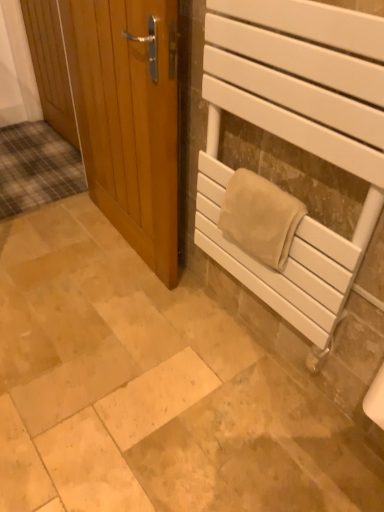
This screenshot has height=512, width=384. I want to click on wooden door at left, the second door when ordered from right to left, so click(50, 66).

You are a GUI agent. You are given a task and a screenshot of the screen. Output one action in this format:
    pyautogui.click(x=<x>, y=<y>)
    Task: Click on the light brown wooden door at left, the 1th door in the front-to-back sequence
    Image resolution: width=384 pixels, height=512 pixels.
    Given the screenshot: What is the action you would take?
    pyautogui.click(x=129, y=118)

In order to face beige soft towel at right, should I rotate leftwards or rightwards?

Turn right approximately 9.276 degrees to face it.

At what (x,y) coordinates should I click in order to perform the action: click on white matte towel rack at right. Please return your answer as a coordinate pair (x, y). Looking at the image, I should click on (295, 138).

Image resolution: width=384 pixels, height=512 pixels. In order to click on wooden door at left, marked as the second door in a front-to-back arrangement in this screenshot , I will do `click(50, 66)`.

From a real-world perspective, between wooden door at left, the second door when ordered from right to left, and light brown wooden door at left, arranged as the 2th door when viewed from the back, who is vertically higher?

light brown wooden door at left, arranged as the 2th door when viewed from the back, is physically above.

Considering their positions, is wooden door at left, marked as the second door in a front-to-back arrangement, located in front of or behind light brown wooden door at left, the 1th door in the front-to-back sequence?

wooden door at left, marked as the second door in a front-to-back arrangement, is positioned farther from the viewer than light brown wooden door at left, the 1th door in the front-to-back sequence.

Does point (38, 31) appear closer or farther from the camera than point (129, 106)?

Point (38, 31) appears to be farther away from the viewer than point (129, 106).

Considering the relative sizes of wooden door at left, marked as the second door in a front-to-back arrangement, and light brown wooden door at left, the 1th door in the front-to-back sequence, in the image provided, is wooden door at left, marked as the second door in a front-to-back arrangement, shorter than light brown wooden door at left, the 1th door in the front-to-back sequence,?

Yes.

Between wooden door at left, the second door when ordered from right to left, and beige soft towel at right, which one has smaller width?

Thinner between the two is wooden door at left, the second door when ordered from right to left.

In order to click on the 2nd door behind when counting from the beige soft towel at right in this screenshot , I will do `click(50, 66)`.

Can you confirm if wooden door at left, marked as the second door in a front-to-back arrangement, is positioned to the left of beige soft towel at right?

Yes, wooden door at left, marked as the second door in a front-to-back arrangement, is to the left of beige soft towel at right.

From a real-world perspective, between wooden door at left, marked as the second door in a front-to-back arrangement, and beige soft towel at right, who is vertically higher?

beige soft towel at right.

Is light brown wooden door at left, the second door from the left, not near beige soft towel at right?

No, there isn't a large distance between light brown wooden door at left, the second door from the left, and beige soft towel at right.

Considering the relative sizes of light brown wooden door at left, the 1th door in the front-to-back sequence, and beige soft towel at right in the image provided, is light brown wooden door at left, the 1th door in the front-to-back sequence, bigger than beige soft towel at right?

Correct, light brown wooden door at left, the 1th door in the front-to-back sequence, is larger in size than beige soft towel at right.

Considering the points (139, 58) and (304, 214), which point is behind, point (139, 58) or point (304, 214)?

The point (139, 58) is farther from the camera.

From the image's perspective, relative to beige soft towel at right, is light brown wooden door at left, the 1th door in the front-to-back sequence, above or below?

light brown wooden door at left, the 1th door in the front-to-back sequence, is above beige soft towel at right.

Where is `elevator above the wooden door at left, which is counted as the first door, starting from the back (from a real-world perspective)`? elevator above the wooden door at left, which is counted as the first door, starting from the back (from a real-world perspective) is located at coordinates (295, 138).

Considering the points (30, 38) and (203, 243), which point is in front, point (30, 38) or point (203, 243)?

The point (203, 243) is more forward.

Does wooden door at left, which is counted as the 1th door, starting from the left, have a lesser height compared to white matte towel rack at right?

Indeed, wooden door at left, which is counted as the 1th door, starting from the left, has a lesser height compared to white matte towel rack at right.

Is the position of wooden door at left, marked as the second door in a front-to-back arrangement, more distant than that of white matte towel rack at right?

That is True.

How far apart are beige soft towel at right and wooden door at left, marked as the second door in a front-to-back arrangement?

beige soft towel at right is 1.55 meters away from wooden door at left, marked as the second door in a front-to-back arrangement.

Locate an element on the screen. The image size is (384, 512). the 2nd door positioned above the beige soft towel at right (from the image's perspective) is located at coordinates [x=50, y=66].

Is beige soft towel at right outside of wooden door at left, which is counted as the 1th door, starting from the left?

Yes, beige soft towel at right is not within wooden door at left, which is counted as the 1th door, starting from the left.

Considering the relative sizes of beige soft towel at right and wooden door at left, the second door when ordered from right to left, in the image provided, is beige soft towel at right taller than wooden door at left, the second door when ordered from right to left,?

Incorrect, the height of beige soft towel at right is not larger of that of wooden door at left, the second door when ordered from right to left.

In the image, is light brown wooden door at left, the 1th door in the front-to-back sequence, positioned in front of or behind white matte towel rack at right?

Clearly, light brown wooden door at left, the 1th door in the front-to-back sequence, is behind white matte towel rack at right.

How much distance is there between light brown wooden door at left, arranged as the 2th door when viewed from the back, and white matte towel rack at right?

A distance of 17.17 inches exists between light brown wooden door at left, arranged as the 2th door when viewed from the back, and white matte towel rack at right.

Considering the positions of point (99, 85) and point (317, 290), is point (99, 85) closer or farther from the camera than point (317, 290)?

Point (99, 85) appears to be farther away from the viewer than point (317, 290).

In the scene shown: From their relative heights in the image, would you say light brown wooden door at left, arranged as the 2th door when viewed from the back, is taller or shorter than white matte towel rack at right?

In the image, light brown wooden door at left, arranged as the 2th door when viewed from the back, appears to be taller than white matte towel rack at right.

Are beige soft towel at right and white matte towel rack at right far apart?

That's not correct — beige soft towel at right is a little close to white matte towel rack at right.

Which of these two, beige soft towel at right or white matte towel rack at right, stands taller?

white matte towel rack at right.

Between point (244, 201) and point (339, 263), which one is positioned behind?

The point (244, 201) is more distant.

Considering the positions of objects beige soft towel at right and white matte towel rack at right in the image provided, who is more to the left, beige soft towel at right or white matte towel rack at right?

beige soft towel at right.

What are the coordinates of `door below the light brown wooden door at left, the 1th door in the front-to-back sequence (from a real-world perspective)` in the screenshot? It's located at (50, 66).

In order to click on the 2nd door counting from the left of the beige soft towel at right in this screenshot , I will do `click(50, 66)`.

Consider the image. When comparing their distances from light brown wooden door at left, the 1th door in the front-to-back sequence, does wooden door at left, marked as the second door in a front-to-back arrangement, or beige soft towel at right seem closer?

The object closer to light brown wooden door at left, the 1th door in the front-to-back sequence, is beige soft towel at right.

Considering their positions, is white matte towel rack at right positioned closer to wooden door at left, which is counted as the first door, starting from the back, than light brown wooden door at left, the second door from the left?

light brown wooden door at left, the second door from the left.

Based on their spatial positions, is white matte towel rack at right or wooden door at left, which is counted as the first door, starting from the back, further from beige soft towel at right?

Among the two, wooden door at left, which is counted as the first door, starting from the back, is located further to beige soft towel at right.

Which object lies further to the anchor point beige soft towel at right, wooden door at left, marked as the second door in a front-to-back arrangement, or white matte towel rack at right?

wooden door at left, marked as the second door in a front-to-back arrangement, lies further to beige soft towel at right than the other object.

Based on their spatial positions, is beige soft towel at right or white matte towel rack at right closer to wooden door at left, which is counted as the first door, starting from the back?

The object closer to wooden door at left, which is counted as the first door, starting from the back, is white matte towel rack at right.

When comparing their distances from beige soft towel at right, does light brown wooden door at left, placed as the first door when sorted from right to left, or wooden door at left, marked as the second door in a front-to-back arrangement, seem closer?

light brown wooden door at left, placed as the first door when sorted from right to left, lies closer to beige soft towel at right than the other object.

Looking at the image, which one is located closer to light brown wooden door at left, the 1th door in the front-to-back sequence, wooden door at left, which is counted as the 1th door, starting from the left, or white matte towel rack at right?

Based on the image, white matte towel rack at right appears to be nearer to light brown wooden door at left, the 1th door in the front-to-back sequence.

Estimate the real-world distances between objects in this image. Which object is further from light brown wooden door at left, arranged as the 2th door when viewed from the back, beige soft towel at right or white matte towel rack at right?

beige soft towel at right is further to light brown wooden door at left, arranged as the 2th door when viewed from the back.

Find the location of a particular element. This screenshot has width=384, height=512. door positioned between beige soft towel at right and wooden door at left, which is counted as the first door, starting from the back, from near to far is located at coordinates (129, 118).

This screenshot has width=384, height=512. I want to click on bath towel located between light brown wooden door at left, arranged as the 2th door when viewed from the back, and white matte towel rack at right in the left-right direction, so click(x=260, y=217).

At what (x,y) coordinates should I click in order to perform the action: click on bath towel positioned between white matte towel rack at right and wooden door at left, the second door when ordered from right to left, from near to far. Please return your answer as a coordinate pair (x, y). The image size is (384, 512). Looking at the image, I should click on (260, 217).

At what (x,y) coordinates should I click in order to perform the action: click on door between white matte towel rack at right and wooden door at left, which is counted as the first door, starting from the back, along the z-axis. Please return your answer as a coordinate pair (x, y). The image size is (384, 512). Looking at the image, I should click on (129, 118).